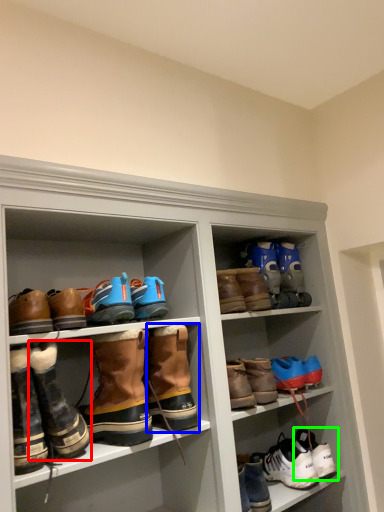
Question: Based on their relative distances, which object is nearer to footwear (highlighted by a red box)? Choose from footwear (highlighted by a blue box) and footwear (highlighted by a green box).

Choices:
 (A) footwear
 (B) footwear

Answer: (A)